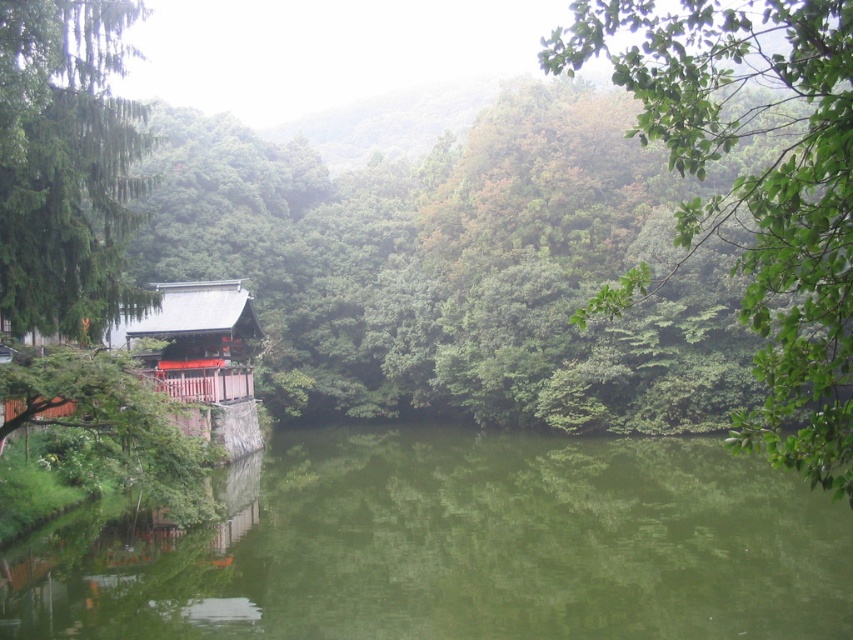
Question: Can you confirm if green leafy tree at left is thinner than shiny red wood hut at left?

Choices:
 (A) yes
 (B) no

Answer: (B)

Question: Among these objects, which one is nearest to the camera?

Choices:
 (A) green leafy tree at left
 (B) shiny red wood hut at left
 (C) green reflective water at center

Answer: (C)

Question: Which object is farther from the camera taking this photo?

Choices:
 (A) green leafy tree at upper right
 (B) green leafy tree at left

Answer: (B)

Question: Does green reflective water at center appear on the left side of green leafy tree at left?

Choices:
 (A) no
 (B) yes

Answer: (A)

Question: Which of the following is the closest to the observer?

Choices:
 (A) shiny red wood hut at left
 (B) green leafy tree at left

Answer: (A)

Question: Is green reflective water at center thinner than green leafy tree at left?

Choices:
 (A) yes
 (B) no

Answer: (B)